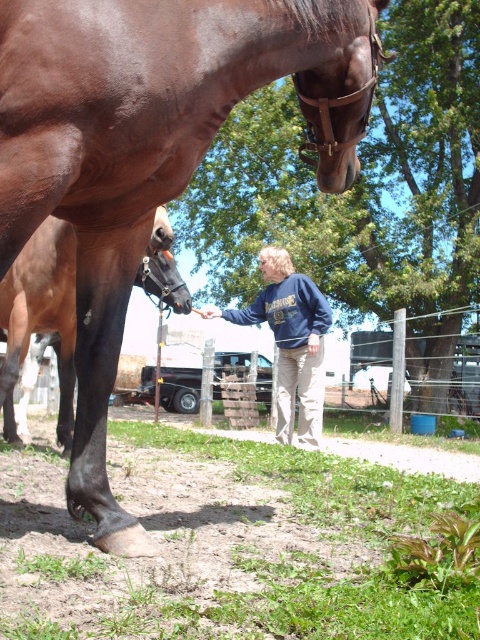
You are a photographer trying to capture the shiny brown horse at center and the black glossy horse leg at lower left in a single shot. Can you see both objects clearly in your camera frame?

The shiny brown horse at center is in front of the black glossy horse leg at lower left, so the black glossy horse leg at lower left may be partially or fully obscured by the shiny brown horse at center, making it difficult to see both clearly in the same frame.

You are a photographer trying to capture a photo of the shiny brown horse at center and the black glossy horse leg at lower left. Which object should you focus on first if you want both in clear focus?

The shiny brown horse at center is to the right of black glossy horse leg at lower left. Since the black glossy horse leg at lower left is closer to the camera, you should focus on it first to ensure both are in clear focus.